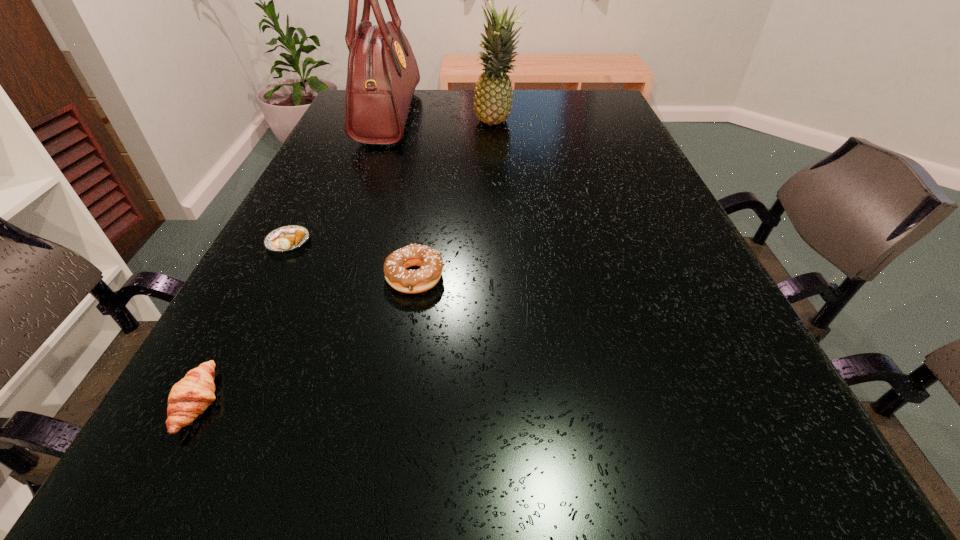
Identify the location of free space at the left edge. The width and height of the screenshot is (960, 540). (297, 194).

What are the coordinates of `free spot at the right edge of the desktop` in the screenshot? It's located at (735, 338).

Where is `vacant area at the far right corner`? This screenshot has width=960, height=540. vacant area at the far right corner is located at coordinates (568, 122).

I want to click on vacant area that lies between the fourth farthest object and the tallest object, so 401,197.

The image size is (960, 540). I want to click on free spot between the handbag and the farther pastry, so click(339, 179).

Image resolution: width=960 pixels, height=540 pixels. I want to click on free space between the fourth shortest object and the doughnut, so click(456, 200).

Identify the location of unoccupied position between the shortest object and the pineapple. (393, 183).

Where is `blank region between the fourth farthest object and the farther pastry`? blank region between the fourth farthest object and the farther pastry is located at coordinates (351, 260).

Find the location of a particular element. Image resolution: width=960 pixels, height=540 pixels. free space between the nearest object and the tallest object is located at coordinates (294, 259).

Where is `free space between the farther pastry and the pineapple`? This screenshot has height=540, width=960. free space between the farther pastry and the pineapple is located at coordinates (393, 183).